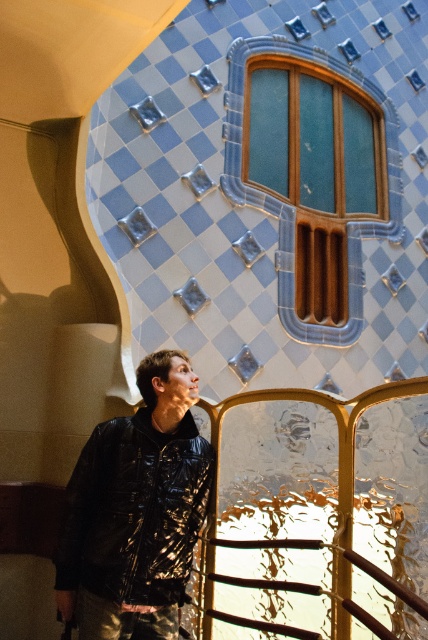
Is shiny black jacket at center wider than teal glass window at upper center?

Incorrect, shiny black jacket at center's width does not surpass teal glass window at upper center's.

Can you confirm if shiny black jacket at center is shorter than teal glass window at upper center?

Yes, shiny black jacket at center is shorter than teal glass window at upper center.

Where is `shiny black jacket at center`? This screenshot has height=640, width=428. shiny black jacket at center is located at coordinates (136, 512).